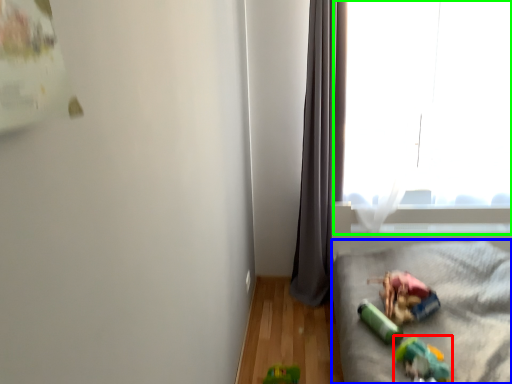
Question: Considering the real-world distances, which object is farthest from toy (highlighted by a red box)? furniture (highlighted by a blue box) or window (highlighted by a green box)?

Choices:
 (A) furniture
 (B) window

Answer: (B)